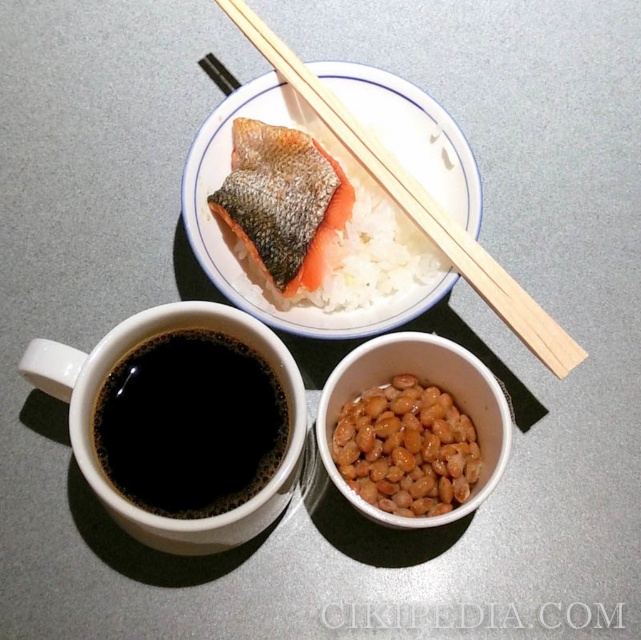
You are setting up a table for a customer and need to place a napkin between the black matte cup at lower left and the wooden chopsticks at upper center. Based on their positions, where should you place the napkin so it is equidistant from both items?

The black matte cup at lower left is closer to the viewer than the wooden chopsticks at upper center. To place the napkin equidistant from both, position it closer to the wooden chopsticks at upper center since the cup is nearer, balancing the distance in three dimensions.